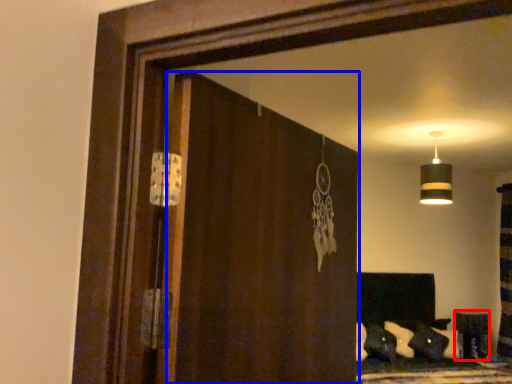
Question: Which point is closer to the camera, furniture (highlighted by a red box) or screen door (highlighted by a blue box)?

Choices:
 (A) furniture
 (B) screen door

Answer: (B)